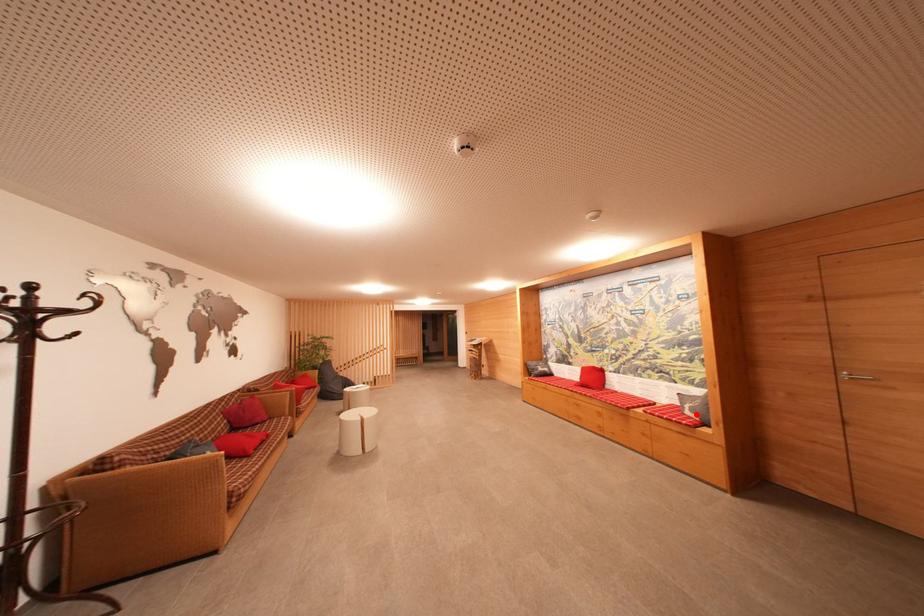
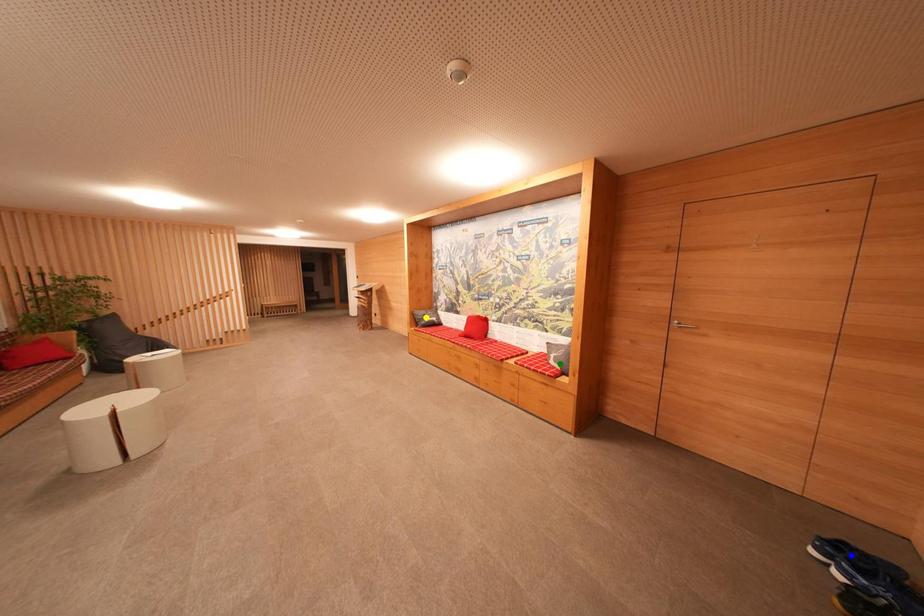
Question: I am providing you with two images of the same scene from different viewpoints. A red point is marked on the first image. You are given multiple points on the second image. Which point in image 2 represents the same 3d spot as the red point in image 1?

Choices:
 (A) green point
 (B) yellow point
 (C) blue point

Answer: (A)